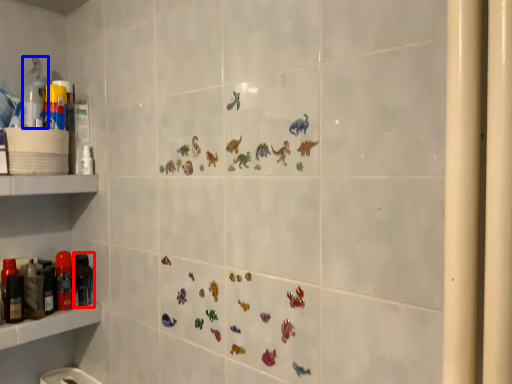
Question: Which object appears farthest to the camera in this image, toiletry (highlighted by a red box) or cleaning product (highlighted by a blue box)?

Choices:
 (A) toiletry
 (B) cleaning product

Answer: (A)